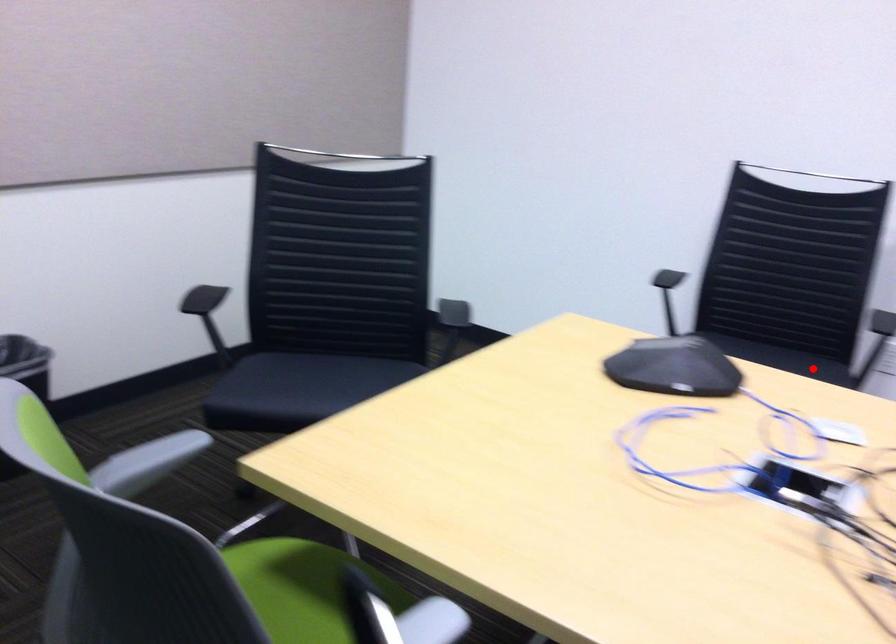
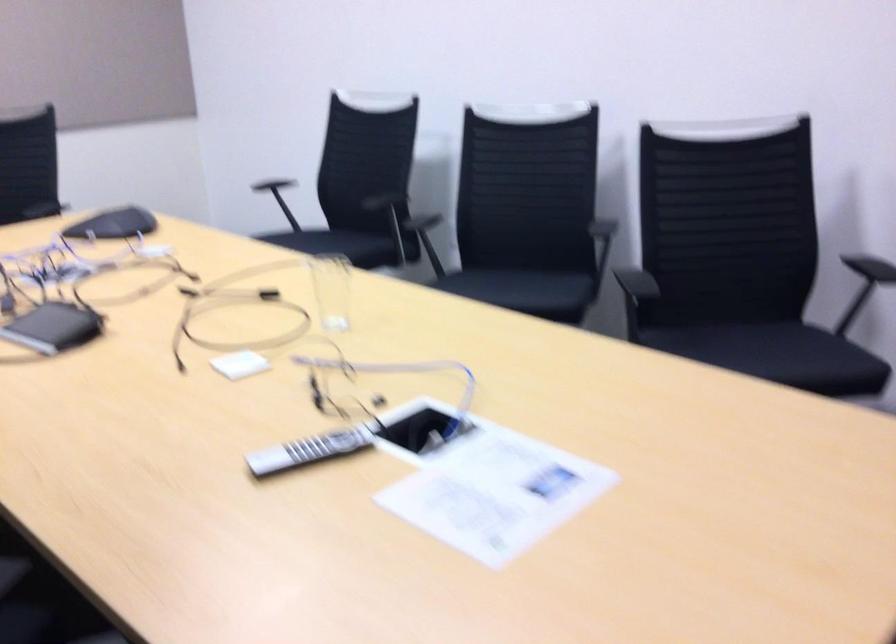
Question: I am providing you with two images of the same scene from different viewpoints. A red point is marked on the first image. Can you still see the location of the red point in image 2?

Choices:
 (A) Yes
 (B) No

Answer: (A)